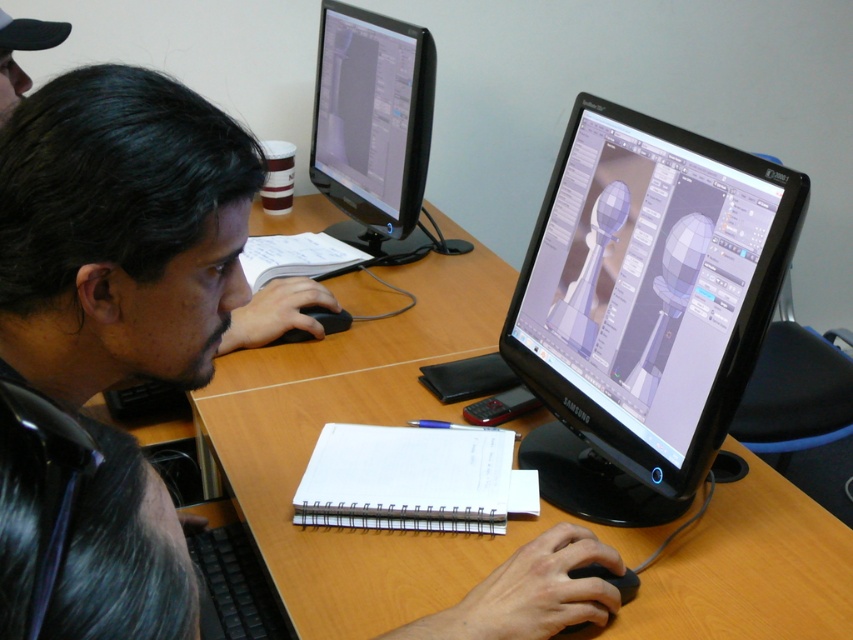
You are setting up a new monitor for the desk in the image. The monitor you have is 10 cm taller than the existing black glossy monitor at center. Will the new monitor fit on the wooden desk at center without exceeding its height?

The wooden desk at center is taller than the black glossy monitor at center. Since the new monitor is only 10 cm taller than the existing one, it might still fit as long as the desk has enough vertical space. However, without knowing the exact dimensions of the desk and the new monitor, it is difficult to confirm definitively.

You are setting up a new computer monitor for a dual monitor setup. You have the wooden desk at center and the black glossy monitor at center. Where should you place the second monitor relative to the existing setup to maintain symmetry?

To maintain symmetry in the dual monitor setup, the second monitor should be placed on the opposite side of the wooden desk at center from the existing black glossy monitor at center.

You are organizing a small event and need to place a 1.5 meter long banner on the wooden desk at center. Considering the size of the black plastic keyboard at lower left, will the banner fit on the desk?

The wooden desk at center has a larger size compared to the black plastic keyboard at lower left. Since the keyboard is smaller, the desk should be sufficiently large to accommodate a 1.5 meter long banner, provided there are no other obstructions. However, the description only mentions the desk being larger than the keyboard, so we cannot confirm about other space constraints.